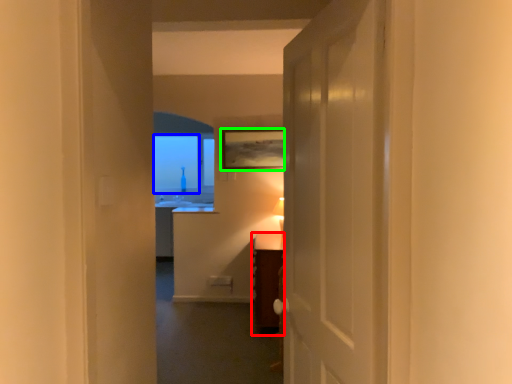
Question: Which is nearer to the vanity (highlighted by a red box)? window screen (highlighted by a blue box) or picture frame (highlighted by a green box).

Choices:
 (A) window screen
 (B) picture frame

Answer: (B)